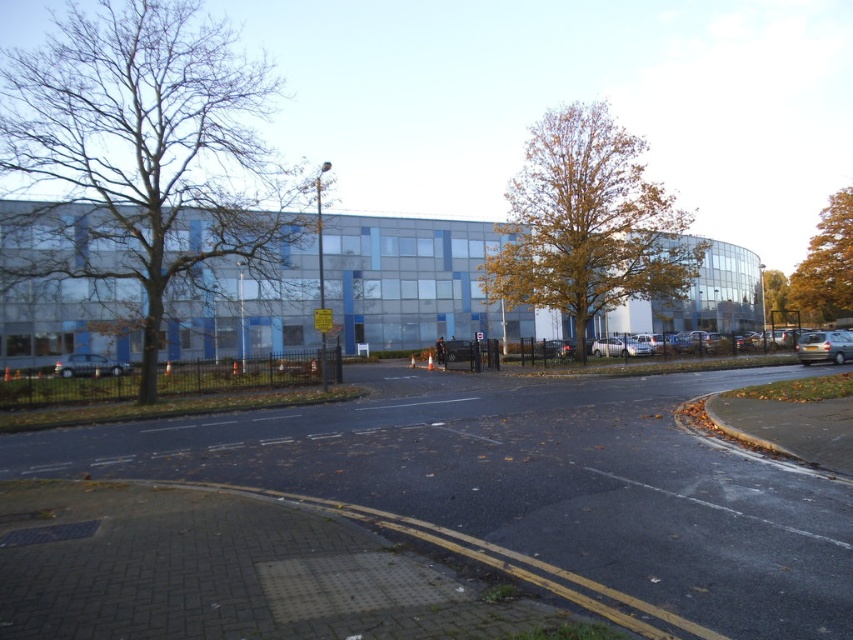
From the picture: Is the position of brown leafy tree at center less distant than that of silver metallic car at right?

Yes, it is.

Can you confirm if brown leafy tree at center is positioned to the left of silver metallic car at right?

Correct, you'll find brown leafy tree at center to the left of silver metallic car at right.

From the picture: Measure the distance between point (624, 164) and camera.

They are 109.86 feet apart.

This screenshot has height=640, width=853. In order to click on brown leafy tree at center in this screenshot , I will do `click(587, 224)`.

Who is taller, brown leafy tree at left or silver metallic car at lower left?

Standing taller between the two is brown leafy tree at left.

Consider the image. Can you confirm if brown leafy tree at left is positioned below silver metallic car at lower left?

No, brown leafy tree at left is not below silver metallic car at lower left.

The width and height of the screenshot is (853, 640). Describe the element at coordinates (140, 157) in the screenshot. I see `brown leafy tree at left` at that location.

What are the coordinates of `brown leafy tree at left` in the screenshot? It's located at (140, 157).

Does yellow leafy tree at upper right have a larger size compared to yellow/golden leaves at upper center?

Yes.

Who is positioned more to the right, yellow leafy tree at upper right or yellow/golden leaves at upper center?

Positioned to the right is yellow leafy tree at upper right.

Which is in front, point (833, 220) or point (776, 269)?

Point (833, 220) is in front.

Where is `yellow leafy tree at upper right`? yellow leafy tree at upper right is located at coordinates (827, 262).